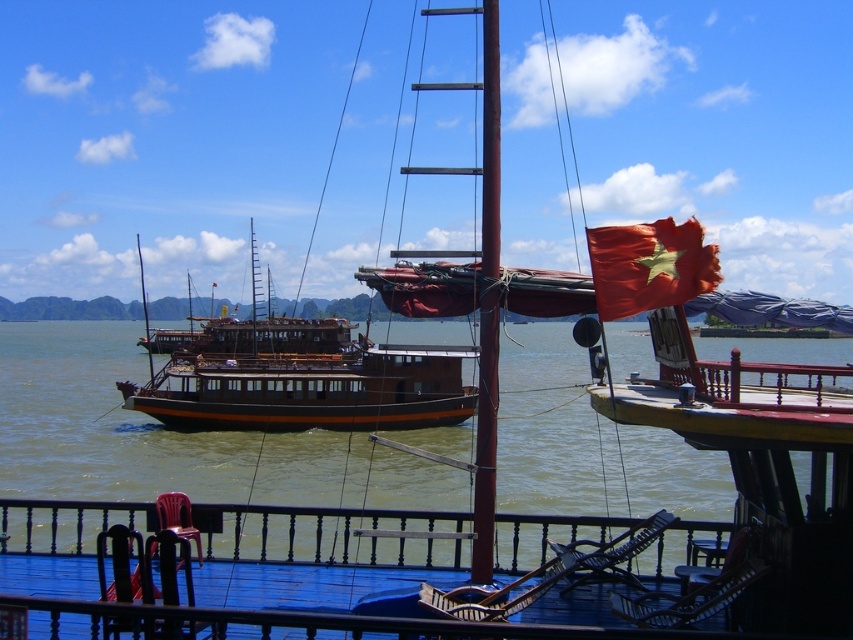
Is point (566, 333) in front of point (595, 296)?

No, (566, 333) is further to viewer.

Which is more to the right, greenish water at center or red matte flag at upper right?

From the viewer's perspective, red matte flag at upper right appears more on the right side.

Is point (241, 476) positioned after point (689, 280)?

Yes, point (241, 476) is behind point (689, 280).

This screenshot has height=640, width=853. Find the location of `greenish water at center`. greenish water at center is located at coordinates 172,436.

Which of these two, brown wooden boat at center or red matte flag at upper right, stands taller?

With more height is brown wooden boat at center.

Who is shorter, brown wooden boat at center or red matte flag at upper right?

Standing shorter between the two is red matte flag at upper right.

Which is behind, point (315, 344) or point (651, 266)?

The point (315, 344) is behind.

Find the location of a particular element. This screenshot has width=853, height=640. brown wooden boat at center is located at coordinates (306, 381).

Between point (640, 490) and point (445, 358), which one is positioned behind?

Positioned behind is point (445, 358).

Where is `greenish water at center`? The height and width of the screenshot is (640, 853). greenish water at center is located at coordinates (172, 436).